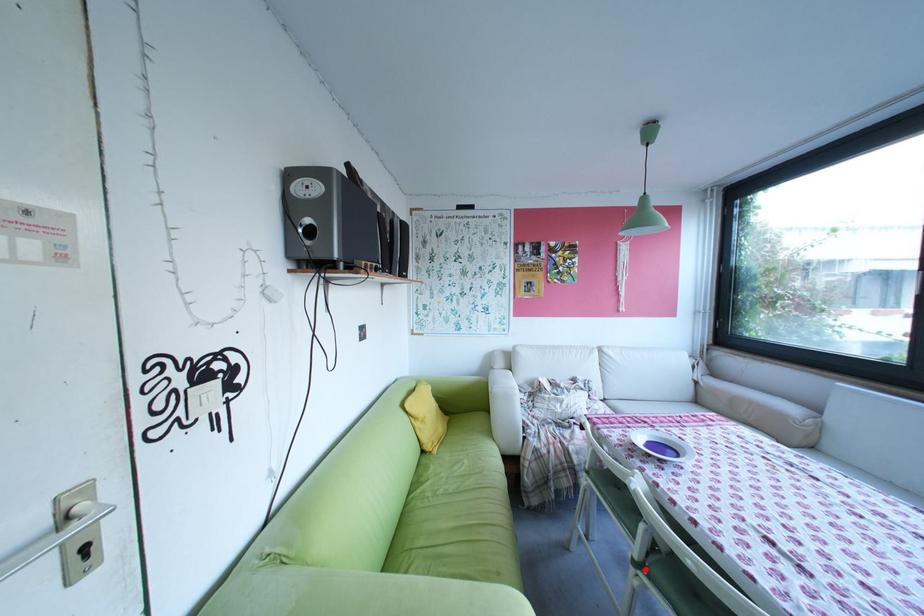
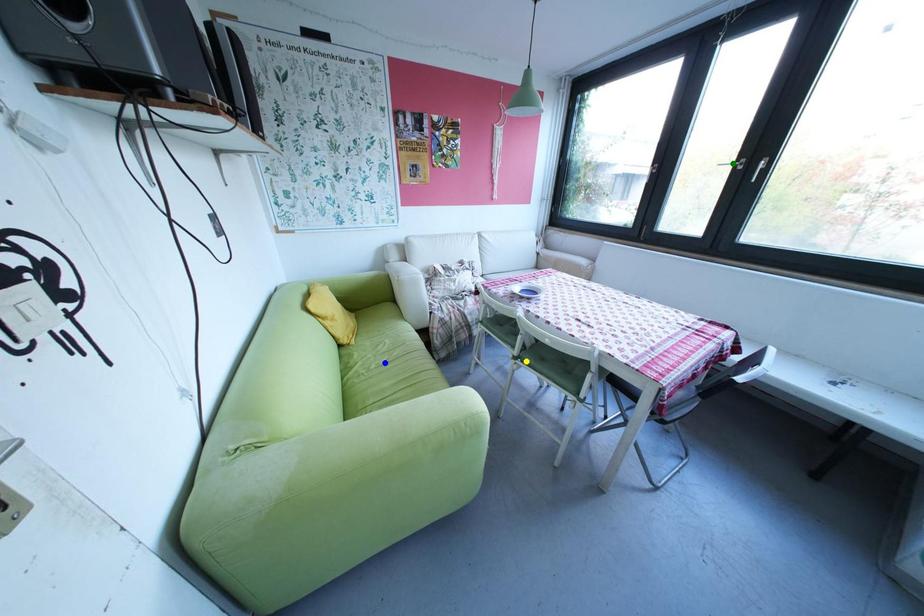
Question: I am providing you with two images of the same scene from different viewpoints. A red point is marked on the first image. You are given multiple points on the second image. Which mark in image 2 goes with the point in image 1?

Choices:
 (A) blue point
 (B) green point
 (C) yellow point

Answer: (C)